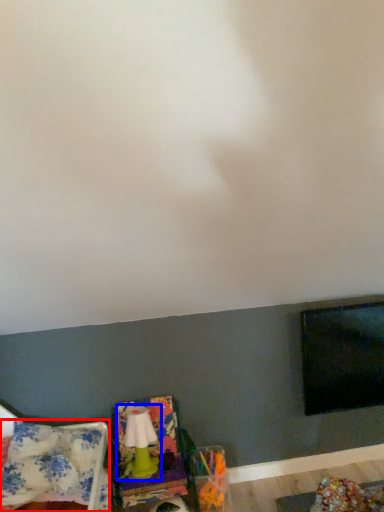
Question: Which point is closer to the camera, blanket (highlighted by a red box) or lamp (highlighted by a blue box)?

Choices:
 (A) blanket
 (B) lamp

Answer: (A)